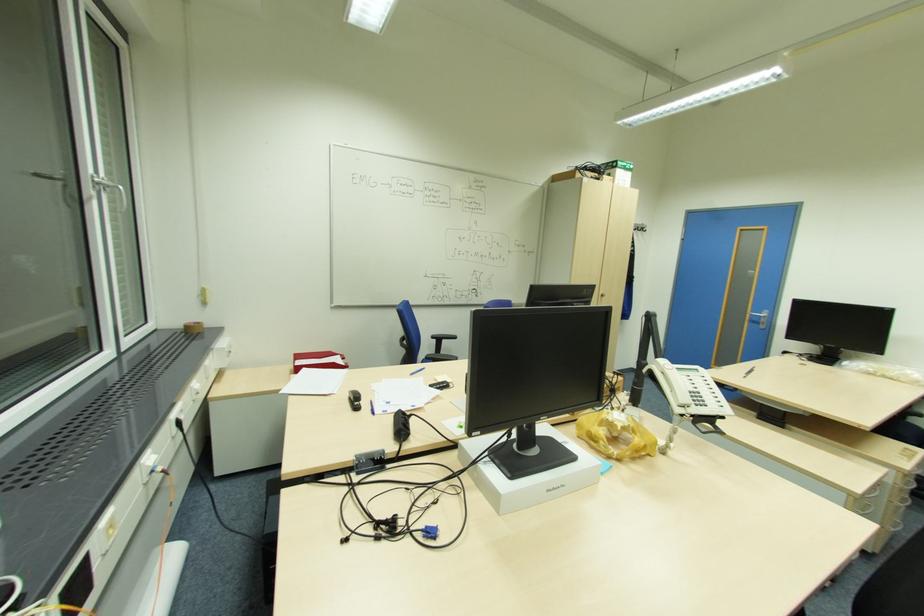
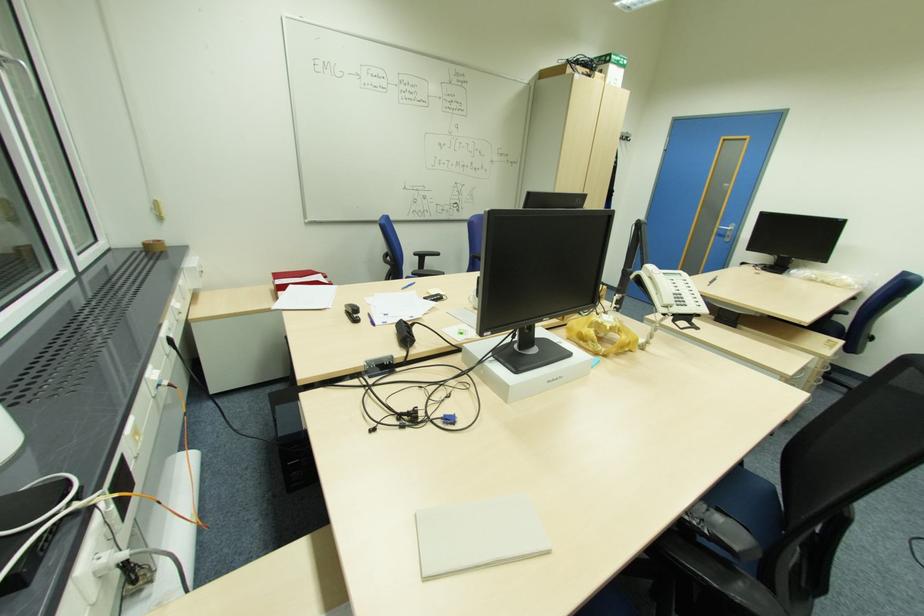
Where in the second image is the point corresponding to point (699, 403) from the first image?

(681, 305)